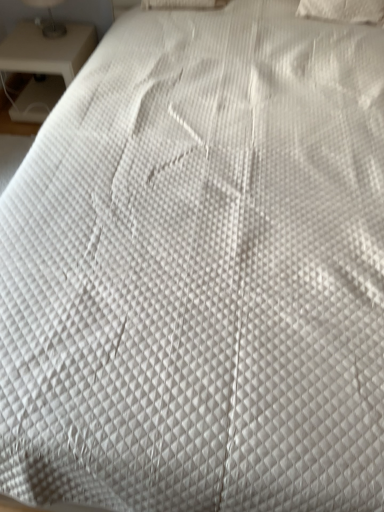
The width and height of the screenshot is (384, 512). What do you see at coordinates (45, 64) in the screenshot?
I see `white matte nightstand at upper left` at bounding box center [45, 64].

Where is `white matte nightstand at upper left`? The width and height of the screenshot is (384, 512). white matte nightstand at upper left is located at coordinates (45, 64).

I want to click on white matte nightstand at upper left, so click(45, 64).